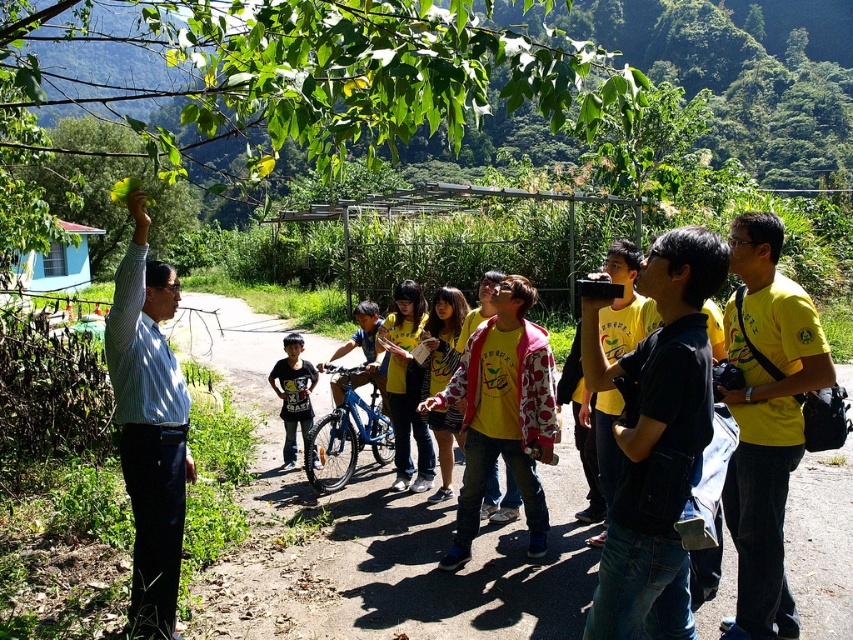
Question: Among these objects, which one is nearest to the camera?

Choices:
 (A) yellow matte shirt at right
 (B) dark blue t-shirt at center
 (C) brown dirt path at center
 (D) striped cotton shirt at center

Answer: (D)

Question: Which point is closer to the camera?

Choices:
 (A) dark blue t-shirt at center
 (B) striped cotton shirt at center
 (C) black matte shirt at center

Answer: (C)

Question: Can you confirm if black matte shirt at center is thinner than striped cotton shirt at center?

Choices:
 (A) yes
 (B) no

Answer: (B)

Question: Can you confirm if striped cotton shirt at center is smaller than dark blue t-shirt at center?

Choices:
 (A) no
 (B) yes

Answer: (A)

Question: Is brown dirt path at center wider than dark blue t-shirt at center?

Choices:
 (A) yes
 (B) no

Answer: (A)

Question: Which point is closer to the camera taking this photo?

Choices:
 (A) (141, 456)
 (B) (308, 428)
 (C) (605, 557)
 (D) (770, 618)

Answer: (C)